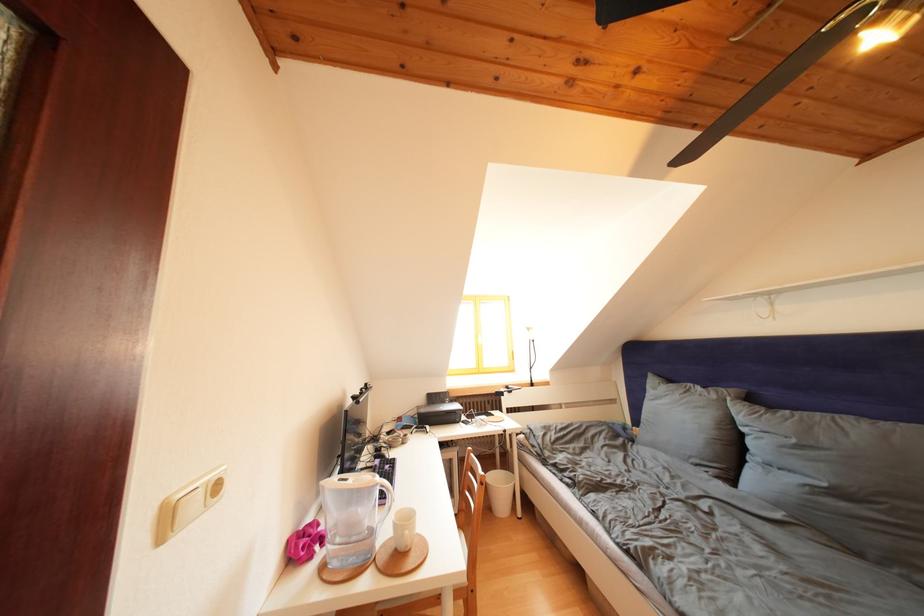
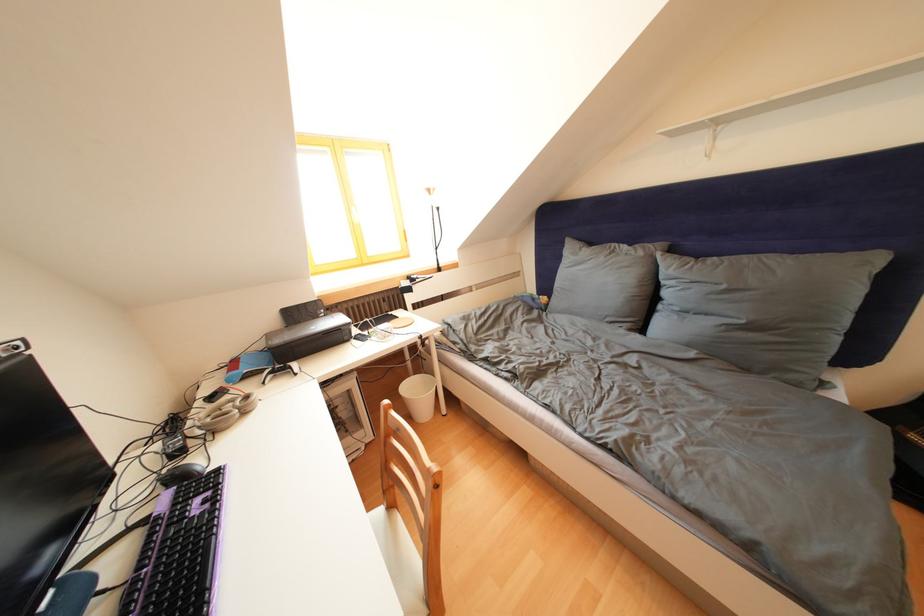
The point at (801, 446) is marked in the first image. Where is the corresponding point in the second image?

(733, 292)